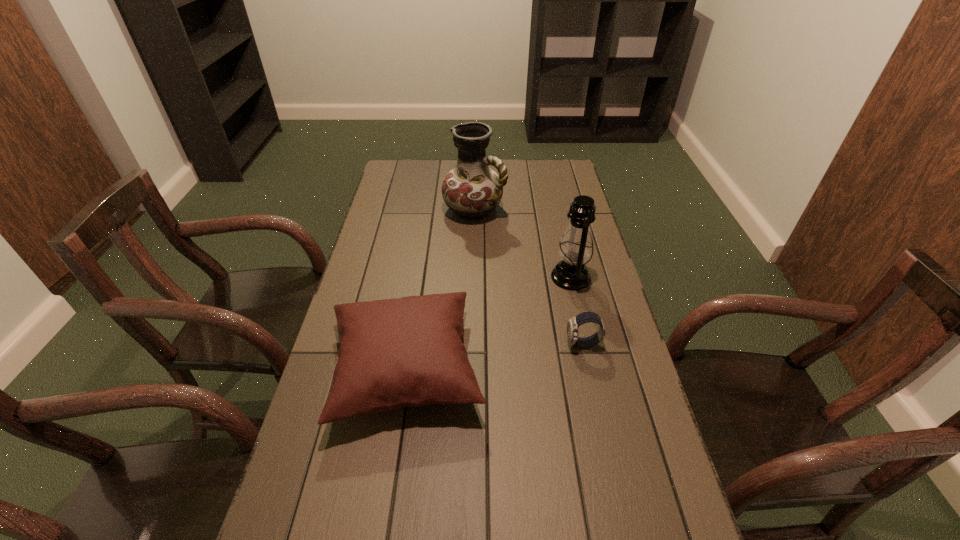
Locate an element on the screen. The width and height of the screenshot is (960, 540). the farthest object is located at coordinates (472, 190).

Locate an element on the screen. The width and height of the screenshot is (960, 540). oil lamp is located at coordinates (576, 246).

I want to click on the third tallest object, so click(x=405, y=352).

Where is `watch`? watch is located at coordinates (573, 324).

This screenshot has height=540, width=960. In order to click on vacant region located on the back of the vase in this screenshot , I will do `click(475, 161)`.

This screenshot has height=540, width=960. What are the coordinates of `vacant space located 0.310m on the back of the second farthest object` in the screenshot? It's located at (556, 212).

Where is `free space located 0.110m on the right of the cushion`? free space located 0.110m on the right of the cushion is located at coordinates (526, 368).

The height and width of the screenshot is (540, 960). In order to click on vacant area situated 0.070m on the face of the shortest object in this screenshot , I will do `click(541, 344)`.

Locate an element on the screen. This screenshot has height=540, width=960. blank area located on the face of the shortest object is located at coordinates (498, 344).

The width and height of the screenshot is (960, 540). I want to click on vacant position located on the face of the shortest object, so click(x=452, y=344).